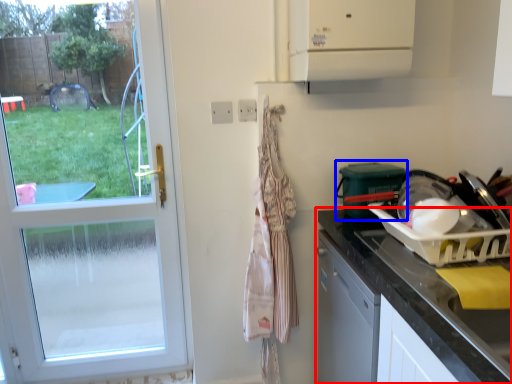
Question: Which point is closer to the camera, countertop (highlighted by a red box) or appliance (highlighted by a blue box)?

Choices:
 (A) countertop
 (B) appliance

Answer: (A)